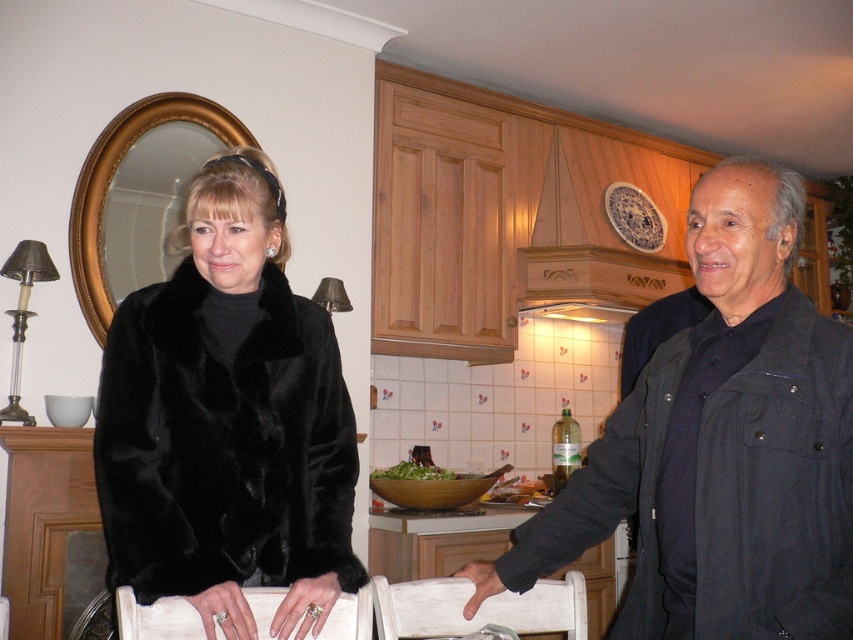
Does black fur coat at upper left have a lesser height compared to black fur coat at left?

Correct, black fur coat at upper left is not as tall as black fur coat at left.

Does point (173, 556) lie in front of point (236, 563)?

Yes, point (173, 556) is closer to viewer.

This screenshot has width=853, height=640. I want to click on black fur coat at upper left, so click(x=227, y=420).

Can you confirm if smooth skin hand at lower center is positioned to the right of green leafy salad at center?

Yes, smooth skin hand at lower center is to the right of green leafy salad at center.

Does point (469, 579) lie in front of point (442, 472)?

Yes, it is in front of point (442, 472).

Find the location of a particular element. This screenshot has width=853, height=640. smooth skin hand at lower center is located at coordinates (479, 582).

Can you confirm if black fur coat at left is positioned to the left of smooth skin hand at lower center?

Yes, black fur coat at left is to the left of smooth skin hand at lower center.

Is black fur coat at left shorter than smooth skin hand at lower center?

Incorrect, black fur coat at left's height does not fall short of smooth skin hand at lower center's.

Is point (303, 541) positioned behind point (480, 576)?

No, it is not.

Locate an element on the screen. The width and height of the screenshot is (853, 640). black fur coat at left is located at coordinates (225, 419).